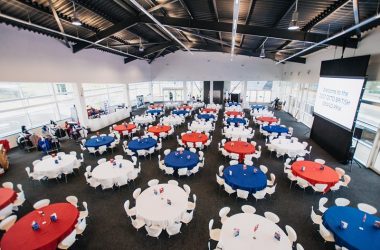
What are the coordinates of `walls` in the screenshot? It's located at (70, 67), (315, 61), (227, 73).